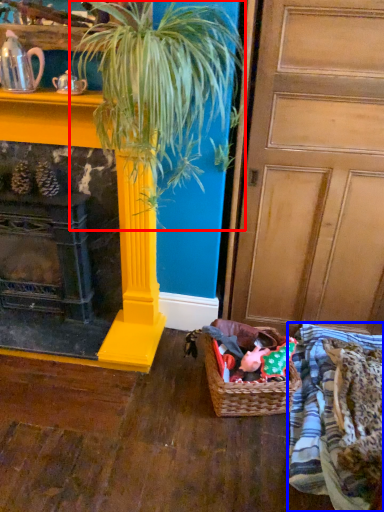
Question: Which point is further to the camera, houseplant (highlighted by a red box) or clothing (highlighted by a blue box)?

Choices:
 (A) houseplant
 (B) clothing

Answer: (B)